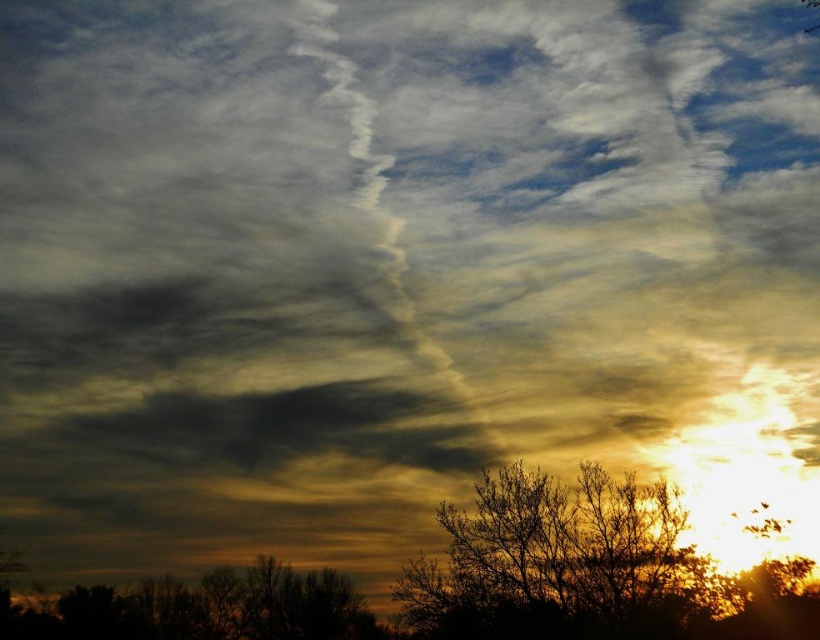
Does point (517, 525) come in front of point (142, 600)?

Yes, it is.

Consider the image. Can you confirm if silhouette bark tree at lower right is shorter than brown matte tree at lower left?

No, silhouette bark tree at lower right is not shorter than brown matte tree at lower left.

Who is more forward, (477, 525) or (228, 632)?

Positioned in front is point (477, 525).

Identify the location of silhouette bark tree at lower right. This screenshot has height=640, width=820. (552, 557).